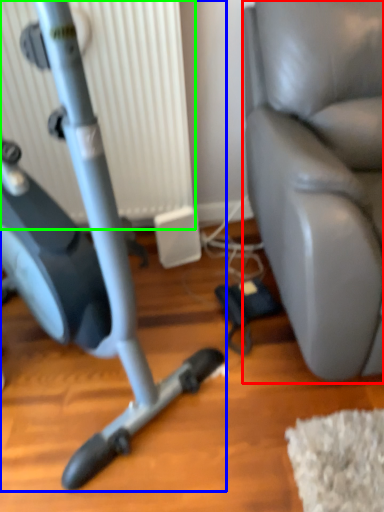
Question: Estimate the real-world distances between objects in this image. Which object is closer to swivel chair (highlighted by a red box), stationary bicycle (highlighted by a blue box) or radiator (highlighted by a green box)?

Choices:
 (A) stationary bicycle
 (B) radiator

Answer: (B)